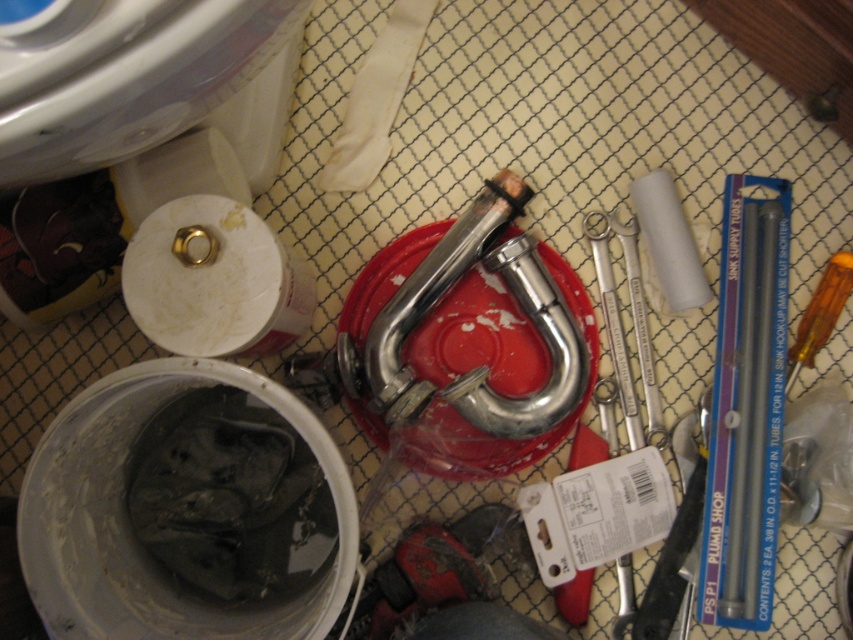
In the scene shown: Is polished silver tube at right positioned at the back of orange plastic screwdriver at right?

That is False.

Is polished silver tube at right to the left of orange plastic screwdriver at right from the viewer's perspective?

Indeed, polished silver tube at right is positioned on the left side of orange plastic screwdriver at right.

You are a GUI agent. You are given a task and a screenshot of the screen. Output one action in this format:
    pyautogui.click(x=<x>, y=<y>)
    Task: Click on the polished silver tube at right
    The width and height of the screenshot is (853, 640).
    Given the screenshot: What is the action you would take?
    750,401

Can you confirm if orange plastic screwdriver at right is positioned to the left of silver metallic wrench at center-right?

In fact, orange plastic screwdriver at right is to the right of silver metallic wrench at center-right.

Is orange plastic screwdriver at right to the right of silver metallic wrench at center-right from the viewer's perspective?

Correct, you'll find orange plastic screwdriver at right to the right of silver metallic wrench at center-right.

Does point (836, 268) lie in front of point (645, 349)?

No, it is not.

At what (x,y) coordinates should I click in order to perform the action: click on orange plastic screwdriver at right. Please return your answer as a coordinate pair (x, y). Image resolution: width=853 pixels, height=640 pixels. Looking at the image, I should click on (820, 314).

Can you confirm if polished silver tube at right is positioned to the right of silver metallic wrench at center-right?

Yes, polished silver tube at right is to the right of silver metallic wrench at center-right.

Where is `polished silver tube at right`? This screenshot has width=853, height=640. polished silver tube at right is located at coordinates (750, 401).

The image size is (853, 640). What do you see at coordinates (750, 401) in the screenshot?
I see `polished silver tube at right` at bounding box center [750, 401].

At what (x,y) coordinates should I click in order to perform the action: click on polished silver tube at right. Please return your answer as a coordinate pair (x, y). This screenshot has height=640, width=853. Looking at the image, I should click on (750, 401).